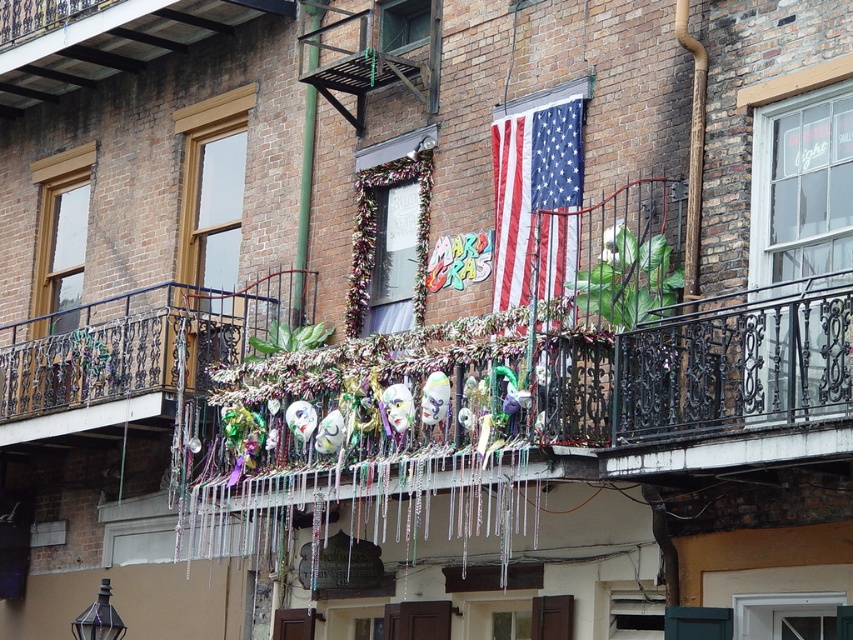
You are standing on the balcony and want to reach both the point at coordinates (270, 314) and the point at coordinates (395, 49). Which point is closer to you?

Point (395, 49) is closer to you because it is less far from the camera than point (270, 314).

You are a photographer standing at a certain distance from the metallic wrought iron balcony at center. You want to capture a clear photo of it without any distortion. According to photography guidelines, the minimum safe distance to avoid distortion for wide angle lenses is 50 meters. Can you take a clear photo from your current position?

The distance between you and the metallic wrought iron balcony at center is 53.57 meters, which is greater than the minimum safe distance of 50 meters. Therefore, you can take a clear photo without distortion.

You are standing on the balcony looking at the festive decorations. You see the american flag at center and the green metal pole at center. Which object is closer to the ground?

The american flag at center is located below the green metal pole at center, so it is closer to the ground.